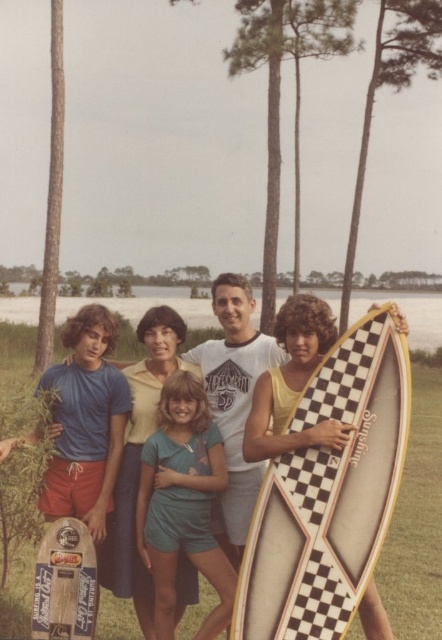
Question: Can you confirm if matte black surfboard at center is smaller than white checkered surfboard at center?

Choices:
 (A) yes
 (B) no

Answer: (A)

Question: Estimate the real-world distances between objects in this image. Which object is farther from the matte black surfboard at center?

Choices:
 (A) checkerboard-patterned surfboard at center
 (B) white checkered surfboard at center

Answer: (B)

Question: Estimate the real-world distances between objects in this image. Which object is closer to the matte black surfboard at center?

Choices:
 (A) white checkered surfboard at center
 (B) checkerboard-patterned surfboard at center

Answer: (B)

Question: Which object is the farthest from the white checkered surfboard at center?

Choices:
 (A) matte black surfboard at center
 (B) checkerboard-patterned surfboard at center

Answer: (A)

Question: Is checkerboard-patterned surfboard at center to the right of white checkered surfboard at center from the viewer's perspective?

Choices:
 (A) no
 (B) yes

Answer: (B)

Question: Is checkerboard-patterned surfboard at center closer to camera compared to white checkered surfboard at center?

Choices:
 (A) no
 (B) yes

Answer: (B)